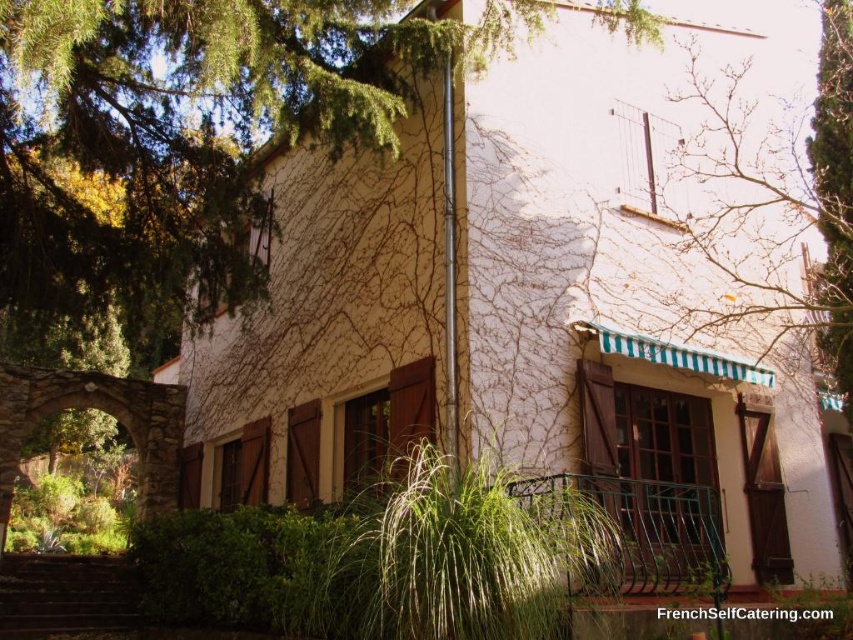
This screenshot has height=640, width=853. Describe the element at coordinates (778, 196) in the screenshot. I see `green striped awning at upper right` at that location.

Which is above, green striped awning at upper right or brown wooden stairs at lower left?

green striped awning at upper right is higher up.

The image size is (853, 640). What do you see at coordinates (778, 196) in the screenshot?
I see `green striped awning at upper right` at bounding box center [778, 196].

Identify the location of green striped awning at upper right. The height and width of the screenshot is (640, 853). (778, 196).

Describe the element at coordinates (184, 140) in the screenshot. I see `green leafy tree at upper left` at that location.

Is green leafy tree at upper left wider than brown wooden stairs at lower left?

No, green leafy tree at upper left is not wider than brown wooden stairs at lower left.

Is point (196, 54) positioned after point (91, 611)?

No, (196, 54) is in front of (91, 611).

Find the location of `green leafy tree at upper left`. green leafy tree at upper left is located at coordinates (184, 140).

Between green ivy at center and green striped awning at upper right, which one is positioned higher?

green striped awning at upper right is higher up.

You are a GUI agent. You are given a task and a screenshot of the screen. Output one action in this format:
    pyautogui.click(x=<x>, y=<y>)
    Task: Click on the green ivy at center
    
    Given the screenshot: What is the action you would take?
    pyautogui.click(x=465, y=554)

Locate an element on the screen. This screenshot has width=853, height=640. green ivy at center is located at coordinates (465, 554).